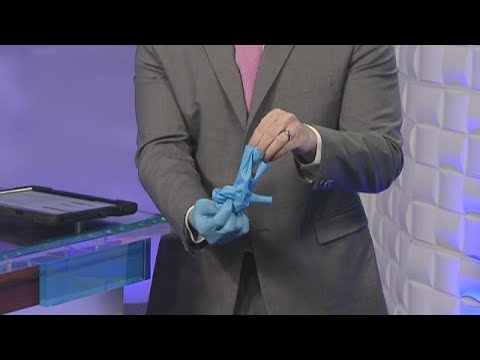
At what (x,y) coordinates should I click in order to perform the action: click on table. Please return your answer as a coordinate pair (x, y). The image size is (480, 360). Looking at the image, I should click on (79, 249).